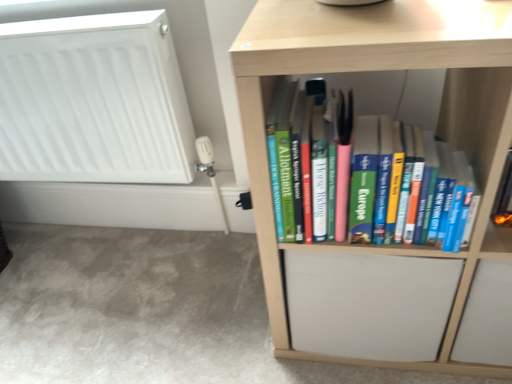
Question: Is white matte radiator at upper left far from light wood bookshelf at center?

Choices:
 (A) yes
 (B) no

Answer: (B)

Question: Could you tell me if white matte radiator at upper left is facing light wood bookshelf at center?

Choices:
 (A) yes
 (B) no

Answer: (B)

Question: From the image's perspective, is white matte radiator at upper left on light wood bookshelf at center?

Choices:
 (A) yes
 (B) no

Answer: (A)

Question: Does white matte radiator at upper left have a larger size compared to light wood bookshelf at center?

Choices:
 (A) yes
 (B) no

Answer: (B)

Question: Does white matte radiator at upper left have a lesser width compared to light wood bookshelf at center?

Choices:
 (A) yes
 (B) no

Answer: (A)

Question: Is white matte radiator at upper left not within light wood bookshelf at center?

Choices:
 (A) yes
 (B) no

Answer: (A)

Question: Does light wood bookshelf at center have a greater height compared to white matte radiator at upper left?

Choices:
 (A) yes
 (B) no

Answer: (A)

Question: Can you confirm if light wood bookshelf at center is thinner than white matte radiator at upper left?

Choices:
 (A) no
 (B) yes

Answer: (A)

Question: Is light wood bookshelf at center to the right of white matte radiator at upper left from the viewer's perspective?

Choices:
 (A) yes
 (B) no

Answer: (A)

Question: Does light wood bookshelf at center have a lesser height compared to white matte radiator at upper left?

Choices:
 (A) yes
 (B) no

Answer: (B)

Question: Can you confirm if light wood bookshelf at center is positioned to the left of white matte radiator at upper left?

Choices:
 (A) no
 (B) yes

Answer: (A)

Question: From a real-world perspective, is light wood bookshelf at center positioned over white matte radiator at upper left based on gravity?

Choices:
 (A) yes
 (B) no

Answer: (B)

Question: From a real-world perspective, is white matte radiator at upper left above or below light wood bookshelf at center?

Choices:
 (A) below
 (B) above

Answer: (B)